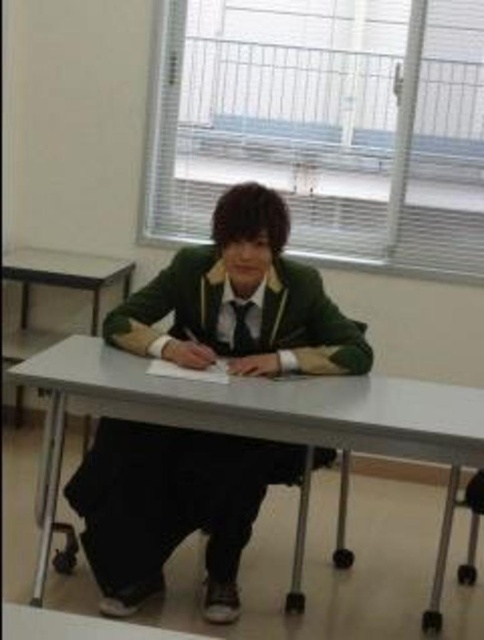
Can you confirm if green fabric uniform at center is positioned to the right of white plastic table at center?

No, green fabric uniform at center is not to the right of white plastic table at center.

Does green fabric uniform at center have a greater height compared to white plastic table at center?

Incorrect, green fabric uniform at center's height is not larger of white plastic table at center's.

Does point (332, 317) lie behind point (46, 365)?

Yes, it is behind point (46, 365).

Where is `green fabric uniform at center`? This screenshot has height=640, width=484. green fabric uniform at center is located at coordinates (171, 506).

Does white plastic table at center appear under matte black tie at center?

Yes.

Is point (271, 394) positioned after point (242, 352)?

No, (271, 394) is closer to viewer.

I want to click on white plastic table at center, so click(x=260, y=420).

Who is taller, green fabric uniform at center or matte black tie at center?

green fabric uniform at center

Is green fabric uniform at center closer to camera compared to matte black tie at center?

Yes, green fabric uniform at center is closer to the viewer.

Who is more forward, (236, 525) or (251, 307)?

Point (236, 525)

You are a GUI agent. You are given a task and a screenshot of the screen. Output one action in this format:
    pyautogui.click(x=<x>, y=<y>)
    Task: Click on the green fabric uniform at center
    The image size is (484, 640).
    Given the screenshot: What is the action you would take?
    pyautogui.click(x=171, y=506)